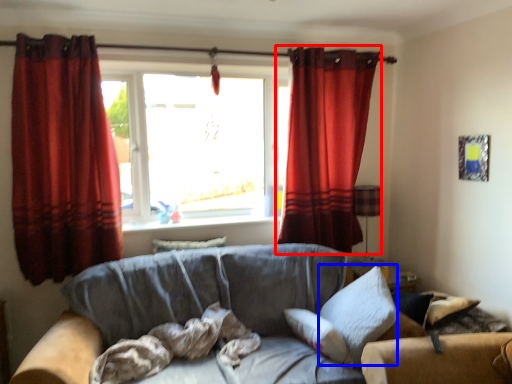
Question: Which object is closer to the camera taking this photo, curtain (highlighted by a red box) or pillow (highlighted by a blue box)?

Choices:
 (A) curtain
 (B) pillow

Answer: (B)